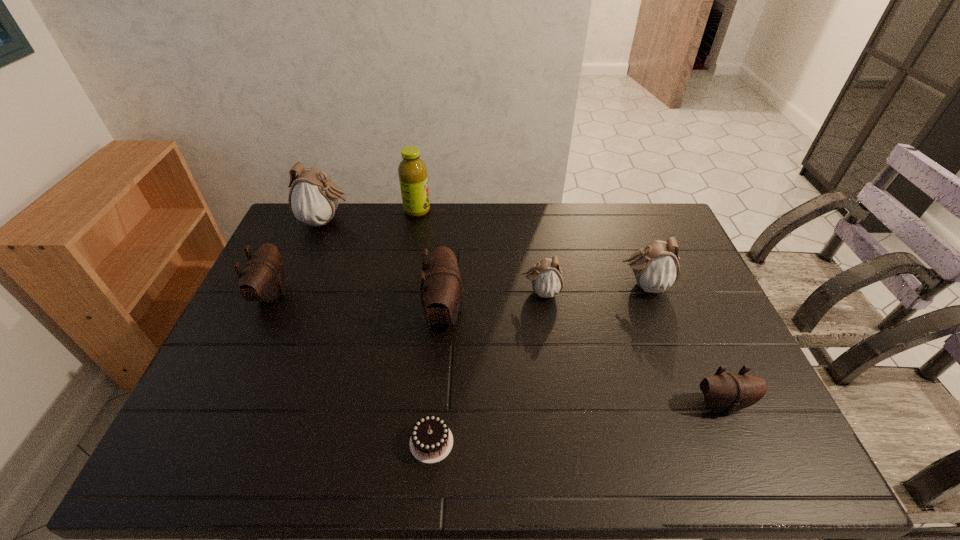
Identify the location of fruit juice. This screenshot has width=960, height=540. (412, 171).

Identify the location of the leftmost white pouch. The width and height of the screenshot is (960, 540). (313, 199).

Where is `the biggest white pouch`? The height and width of the screenshot is (540, 960). the biggest white pouch is located at coordinates (313, 199).

I want to click on the third pouch from left to right, so click(x=441, y=284).

Identify the location of the second brown pouch from right to left. This screenshot has height=540, width=960. (441, 284).

In order to click on the rightmost white pouch in this screenshot , I will do `click(656, 268)`.

I want to click on the leftmost brown pouch, so click(x=262, y=279).

The width and height of the screenshot is (960, 540). In order to click on the third pouch from right to left in this screenshot , I will do `click(546, 276)`.

Where is `the second white pouch from right to left`? the second white pouch from right to left is located at coordinates (546, 276).

You are a GUI agent. You are given a task and a screenshot of the screen. Output one action in this format:
    pyautogui.click(x=<x>, y=<y>)
    Task: Click on the smallest brown pouch
    The width and height of the screenshot is (960, 540).
    Given the screenshot: What is the action you would take?
    pyautogui.click(x=729, y=392)